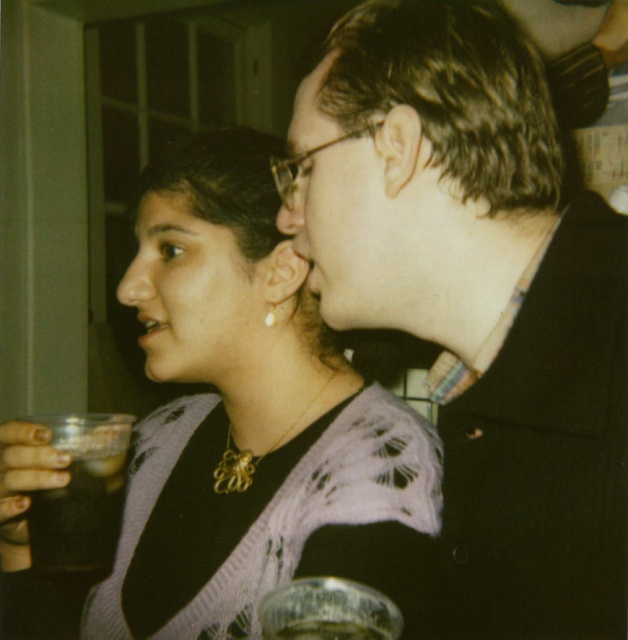
Question: Can you confirm if matte black glasses at center is positioned to the right of matte skin forehead at upper center?

Choices:
 (A) yes
 (B) no

Answer: (A)

Question: Does purple knitted sweater at upper left have a larger size compared to matte skin forehead at upper center?

Choices:
 (A) no
 (B) yes

Answer: (B)

Question: Estimate the real-world distances between objects in this image. Which object is closer to the transparent plastic wine glass at lower center?

Choices:
 (A) pearl earrings at center
 (B) clear glass at lower center

Answer: (B)

Question: Can you confirm if purple knitted sweater at upper left is thinner than translucent plastic cup at lower left?

Choices:
 (A) yes
 (B) no

Answer: (B)

Question: Which point appears farthest from the camera in this image?

Choices:
 (A) (359, 161)
 (B) (38, 520)
 (C) (327, 634)

Answer: (B)

Question: Which point is farther from the camera taking this photo?

Choices:
 (A) (327, 477)
 (B) (207, 216)

Answer: (B)